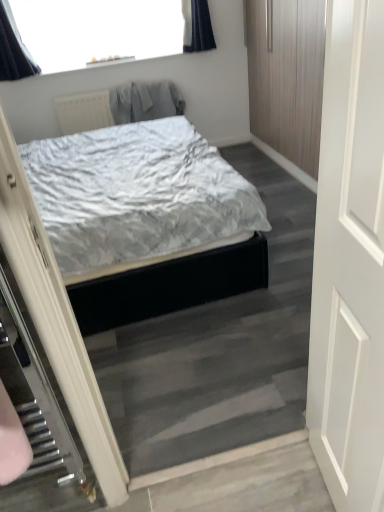
In the scene shown: In order to face gray fabric robe at upper center, should I rotate leftwards or rightwards?

Rotate left and turn 5.731 degrees.

At what (x,y) coordinates should I click in order to perform the action: click on gray fabric robe at upper center. Please return your answer as a coordinate pair (x, y). The height and width of the screenshot is (512, 384). Looking at the image, I should click on (145, 102).

What do you see at coordinates (145, 102) in the screenshot? Image resolution: width=384 pixels, height=512 pixels. I see `gray fabric robe at upper center` at bounding box center [145, 102].

Describe the element at coordinates (350, 262) in the screenshot. I see `white matte door at right` at that location.

The image size is (384, 512). What are the coordinates of `white matte door at right` in the screenshot? It's located at (350, 262).

Where is `gray fabric robe at upper center`? This screenshot has width=384, height=512. gray fabric robe at upper center is located at coordinates (145, 102).

Which is more to the right, white matte door at right or gray fabric robe at upper center?

Positioned to the right is white matte door at right.

Which object is further away from the camera taking this photo, white matte door at right or gray fabric robe at upper center?

gray fabric robe at upper center is behind.

Considering the positions of points (366, 244) and (139, 103), is point (366, 244) closer to camera compared to point (139, 103)?

Yes.

From the image's perspective, which one is positioned lower, white matte door at right or gray fabric robe at upper center?

white matte door at right appears lower in the image.

From a real-world perspective, is white matte door at right located higher than gray fabric robe at upper center?

Yes, from a real-world perspective, white matte door at right is over gray fabric robe at upper center

Between white matte door at right and gray fabric robe at upper center, which one has larger width?

With larger width is gray fabric robe at upper center.

Is white matte door at right shorter than gray fabric robe at upper center?

No.

Does white matte door at right have a larger size compared to gray fabric robe at upper center?

Yes.

Is white matte door at right outside of gray fabric robe at upper center?

Yes, white matte door at right is located beyond the bounds of gray fabric robe at upper center.

Is white matte door at right far away from gray fabric robe at upper center?

white matte door at right is positioned a significant distance from gray fabric robe at upper center.

Is white matte door at right looking in the opposite direction of gray fabric robe at upper center?

No, gray fabric robe at upper center is not at the back of white matte door at right.

What's the angular difference between white matte door at right and gray fabric robe at upper center's facing directions?

There is a 92.4-degree angle between the facing directions of white matte door at right and gray fabric robe at upper center.

Locate an element on the screen. The width and height of the screenshot is (384, 512). robe behind the white matte door at right is located at coordinates (145, 102).

Is gray fabric robe at upper center to the left or to the right of white matte door at right in the image?

gray fabric robe at upper center is to the left of white matte door at right.

From the picture: Is the position of gray fabric robe at upper center less distant than that of white matte door at right?

That is False.

Is point (136, 111) positioned in front of point (371, 68)?

No, (136, 111) is behind (371, 68).

From the image's perspective, which one is positioned higher, gray fabric robe at upper center or white matte door at right?

gray fabric robe at upper center.

From a real-world perspective, who is located higher, gray fabric robe at upper center or white matte door at right?

white matte door at right is physically above.

Between gray fabric robe at upper center and white matte door at right, which one has smaller width?

white matte door at right is thinner.

Is gray fabric robe at upper center shorter than white matte door at right?

Yes.

Can you confirm if gray fabric robe at upper center is smaller than white matte door at right?

Yes.

Is gray fabric robe at upper center situated inside white matte door at right or outside?

The correct answer is: outside.

Is gray fabric robe at upper center placed right next to white matte door at right?

They are not placed beside each other.

Looking at this image, could you tell me if gray fabric robe at upper center is facing white matte door at right?

Yes, gray fabric robe at upper center is turned towards white matte door at right.

Identify the location of robe lying on the left of white matte door at right. (145, 102).

Locate an element on the screen. The width and height of the screenshot is (384, 512). robe behind the white matte door at right is located at coordinates (145, 102).

Where is `robe that appears above the white matte door at right (from the image's perspective)`? robe that appears above the white matte door at right (from the image's perspective) is located at coordinates (145, 102).